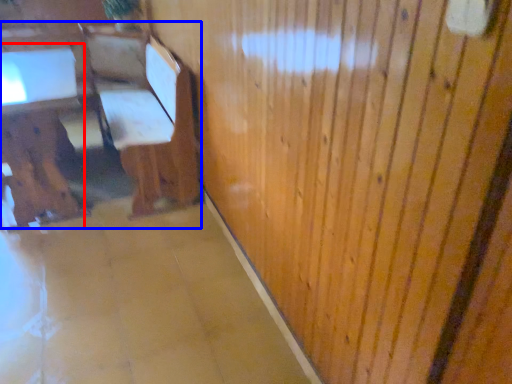
Question: Which of the following is the closest to the observer, table (highlighted by a red box) or furniture (highlighted by a blue box)?

Choices:
 (A) table
 (B) furniture

Answer: (B)